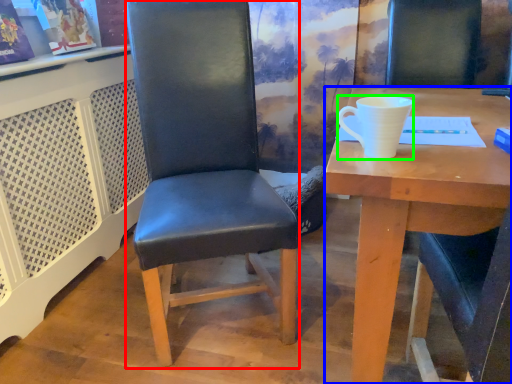
Question: Which is farther away from chair (highlighted by a red box)? desk (highlighted by a blue box) or coffee cup (highlighted by a green box)?

Choices:
 (A) desk
 (B) coffee cup

Answer: (B)